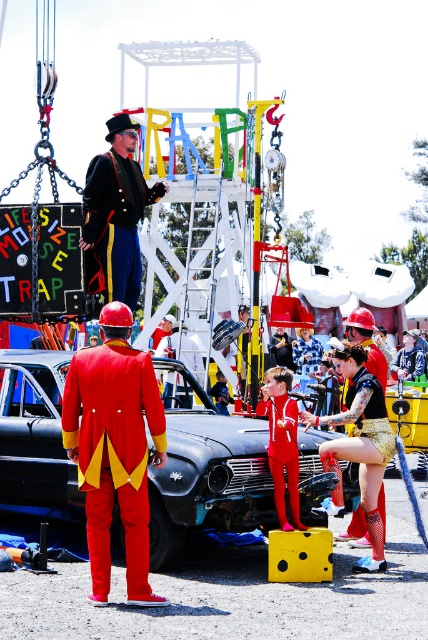
Question: From the image, what is the correct spatial relationship of shiny red tuxedo at center in relation to shiny metallic shorts at center?

Choices:
 (A) right
 (B) left

Answer: (B)

Question: Estimate the real-world distances between objects in this image. Which object is farther from the red velvet suit at center?

Choices:
 (A) shiny red tuxedo at center
 (B) shiny metallic shorts at center
 (C) shiny black uniform at center
 (D) black glossy car at center

Answer: (C)

Question: Can you confirm if shiny metallic shorts at center is bigger than red velvet suit at center?

Choices:
 (A) yes
 (B) no

Answer: (A)

Question: Which object appears closest to the camera in this image?

Choices:
 (A) shiny black uniform at center
 (B) red velvet suit at center
 (C) shiny red tuxedo at center

Answer: (C)

Question: Considering the relative positions of shiny black uniform at center and shiny metallic shorts at center in the image provided, where is shiny black uniform at center located with respect to shiny metallic shorts at center?

Choices:
 (A) right
 (B) left

Answer: (B)

Question: Which point is closer to the camera?

Choices:
 (A) shiny metallic shorts at center
 (B) shiny red tuxedo at center
 (C) shiny black uniform at center
 (D) black glossy car at center

Answer: (B)